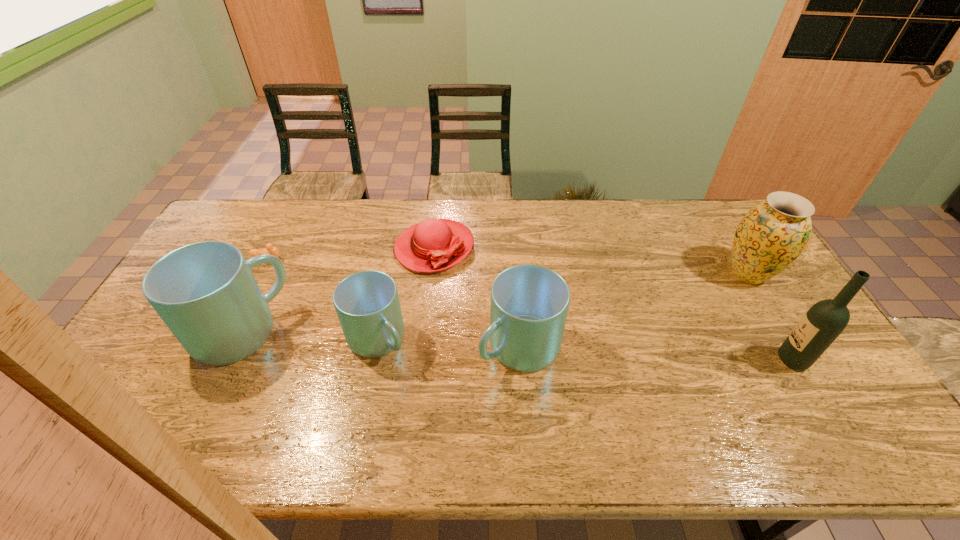
This screenshot has height=540, width=960. Identify the location of vacant area situated on the left of the second mug from left to right. (244, 340).

You are a GUI agent. You are given a task and a screenshot of the screen. Output one action in this format:
    pyautogui.click(x=<x>, y=<y>)
    Task: Click on the free space located 0.250m on the right of the third object from right to left
    The image size is (960, 540).
    Given the screenshot: What is the action you would take?
    pyautogui.click(x=650, y=347)

Locate an element on the screen. Image resolution: width=960 pixels, height=540 pixels. free space located 0.180m on the left of the vase is located at coordinates (665, 274).

What are the coordinates of `free point located at the front of the hat with a bow` in the screenshot? It's located at (425, 333).

Find the location of a particular element. This screenshot has height=540, width=960. blank space located on the face of the shortest object is located at coordinates (348, 260).

Locate an element on the screen. The image size is (960, 540). free point located on the labeled side of the wine bottle is located at coordinates (674, 360).

The height and width of the screenshot is (540, 960). Identify the location of free space located on the labeled side of the wine bottle. (740, 360).

This screenshot has width=960, height=540. Find the location of `vacant area located on the labeled side of the wine bottle`. vacant area located on the labeled side of the wine bottle is located at coordinates (648, 360).

Image resolution: width=960 pixels, height=540 pixels. Identify the location of object that is at the far edge. (432, 245).

Locate an element on the screen. object located at the left edge is located at coordinates (206, 294).